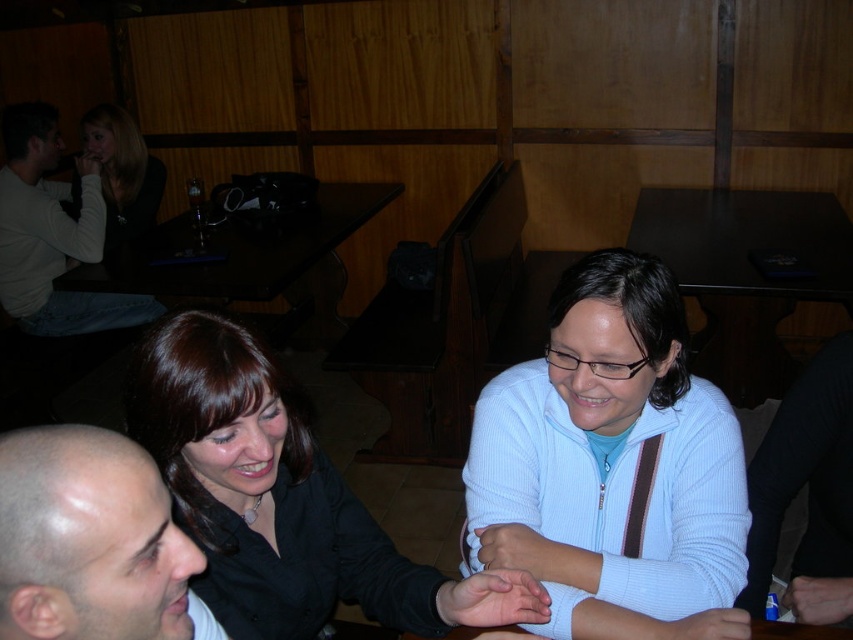
Can you confirm if light blue zip-up sweater at center is positioned above bald head at lower left?

Yes.

The width and height of the screenshot is (853, 640). In order to click on light blue zip-up sweater at center in this screenshot , I will do `click(612, 467)`.

At what (x,y) coordinates should I click in order to perform the action: click on light blue zip-up sweater at center. Please return your answer as a coordinate pair (x, y). The image size is (853, 640). Looking at the image, I should click on (612, 467).

Where is `light blue zip-up sweater at center`? The width and height of the screenshot is (853, 640). light blue zip-up sweater at center is located at coordinates (612, 467).

Does matte black shirt at center have a lesser width compared to matte black hair at upper left?

In fact, matte black shirt at center might be wider than matte black hair at upper left.

At what (x,y) coordinates should I click in order to perform the action: click on matte black shirt at center. Please return your answer as a coordinate pair (x, y). Looking at the image, I should click on (281, 499).

The height and width of the screenshot is (640, 853). Find the location of `matte black shirt at center`. matte black shirt at center is located at coordinates (281, 499).

Does matte black shirt at center have a smaller size compared to black glossy table at center?

Correct, matte black shirt at center occupies less space than black glossy table at center.

Which is in front, point (242, 557) or point (712, 349)?

Point (242, 557) is more forward.

This screenshot has height=640, width=853. In order to click on matte black shirt at center in this screenshot , I will do `click(281, 499)`.